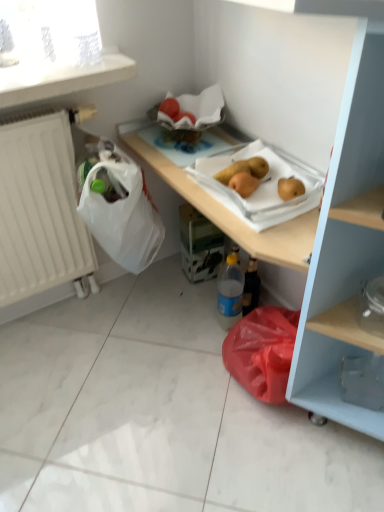
What do you see at coordinates (244, 169) in the screenshot?
I see `yellow matte pear at center` at bounding box center [244, 169].

The height and width of the screenshot is (512, 384). Describe the element at coordinates (230, 292) in the screenshot. I see `blue plastic bottle at lower center` at that location.

At what (x,y) coordinates should I click in order to perform the action: click on yellow matte pear at center. Please return your answer as a coordinate pair (x, y). This screenshot has width=384, height=512. Looking at the image, I should click on (244, 169).

What are the coordinates of `bottle on the right of transparent plastic carton at center` in the screenshot? It's located at (x=230, y=292).

Is transparent plastic carton at center spatially inside blue plastic bottle at lower center, or outside of it?

transparent plastic carton at center is not enclosed by blue plastic bottle at lower center.

From the picture: Considering the sizes of objects transparent plastic carton at center and blue plastic bottle at lower center in the image provided, who is taller, transparent plastic carton at center or blue plastic bottle at lower center?

blue plastic bottle at lower center.

In terms of height, does white matte radiator at left look taller or shorter compared to yellow matte pear at center?

Clearly, white matte radiator at left is taller compared to yellow matte pear at center.

Which is correct: white matte radiator at left is inside yellow matte pear at center, or outside of it?

white matte radiator at left is located beyond the bounds of yellow matte pear at center.

Locate an element on the screen. This screenshot has width=384, height=512. radiator that appears below the yellow matte pear at center (from a real-world perspective) is located at coordinates (41, 211).

From the image's perspective, who appears lower, white matte radiator at left or yellow matte pear at center?

white matte radiator at left appears lower in the image.

Identify the location of food that appears above the white matte radiator at left (from a real-world perspective). This screenshot has width=384, height=512. (244, 169).

Does point (250, 168) appear closer or farther from the camera than point (40, 226)?

Point (250, 168).

In terms of width, does yellow matte pear at center look wider or thinner when compared to white matte radiator at left?

Clearly, yellow matte pear at center has more width compared to white matte radiator at left.

From the picture: Between yellow matte pear at center and white matte radiator at left, which one appears on the left side from the viewer's perspective?

white matte radiator at left.

Locate an element on the screen. The image size is (384, 512). carton below the yellow matte pear at center (from the image's perspective) is located at coordinates (199, 244).

Who is taller, transparent plastic carton at center or yellow matte pear at center?

transparent plastic carton at center is taller.

From the image's perspective, relative to yellow matte pear at center, is transparent plastic carton at center above or below?

Clearly, from the image's perspective, transparent plastic carton at center is below yellow matte pear at center.

Can you confirm if transparent plastic carton at center is thinner than yellow matte pear at center?

No, transparent plastic carton at center is not thinner than yellow matte pear at center.

Could you tell me if white matte radiator at left is facing transparent plastic carton at center?

No, white matte radiator at left is not aimed at transparent plastic carton at center.

From a real-world perspective, is white matte radiator at left positioned under transparent plastic carton at center based on gravity?

Incorrect, from a real-world perspective, white matte radiator at left is higher than transparent plastic carton at center.

From the image's perspective, is white matte radiator at left below transparent plastic carton at center?

Actually, white matte radiator at left appears above transparent plastic carton at center in the image.

Between point (58, 123) and point (209, 253), which one is positioned behind?

The point (209, 253) is farther from the camera.

Is blue plastic bottle at lower center positioned before white matte radiator at left?

No, it is not.

Can white matte radiator at left be found inside blue plastic bottle at lower center?

Actually, white matte radiator at left is outside blue plastic bottle at lower center.

Looking at the image, does blue plastic bottle at lower center seem bigger or smaller compared to white matte radiator at left?

Clearly, blue plastic bottle at lower center is smaller in size than white matte radiator at left.

Is transparent plastic carton at center positioned beyond the bounds of white matte radiator at left?

Absolutely, transparent plastic carton at center is external to white matte radiator at left.

Which of these two, transparent plastic carton at center or white matte radiator at left, is bigger?

white matte radiator at left.

From a real-world perspective, is transparent plastic carton at center located beneath white matte radiator at left?

Indeed, from a real-world perspective, transparent plastic carton at center is positioned beneath white matte radiator at left.

Considering the sizes of objects transparent plastic carton at center and white matte radiator at left in the image provided, who is wider, transparent plastic carton at center or white matte radiator at left?

Wider between the two is transparent plastic carton at center.

Where is `carton behind the blue plastic bottle at lower center`? carton behind the blue plastic bottle at lower center is located at coordinates (199, 244).

Locate an element on the screen. food above the white matte radiator at left (from the image's perspective) is located at coordinates (244, 169).

Estimate the real-world distances between objects in this image. Which object is further from white matte radiator at left, transparent plastic carton at center or yellow matte pear at center?

yellow matte pear at center.

Considering their positions, is blue plastic bottle at lower center positioned further to transparent plastic carton at center than white matte radiator at left?

Based on the image, white matte radiator at left appears to be further to transparent plastic carton at center.

When comparing their distances from yellow matte pear at center, does transparent plastic carton at center or blue plastic bottle at lower center seem further?

blue plastic bottle at lower center is positioned further to the anchor yellow matte pear at center.

Considering their positions, is blue plastic bottle at lower center positioned closer to yellow matte pear at center than transparent plastic carton at center?

transparent plastic carton at center lies closer to yellow matte pear at center than the other object.

From the image, which object appears to be nearer to transparent plastic carton at center, yellow matte pear at center or white matte radiator at left?

The object closer to transparent plastic carton at center is white matte radiator at left.

Looking at this image, from the image, which object appears to be farther from yellow matte pear at center, white matte radiator at left or blue plastic bottle at lower center?

white matte radiator at left is positioned further to the anchor yellow matte pear at center.

Which object lies nearer to the anchor point white matte radiator at left, blue plastic bottle at lower center or yellow matte pear at center?

yellow matte pear at center is closer to white matte radiator at left.

Considering their positions, is white matte radiator at left positioned closer to transparent plastic carton at center than yellow matte pear at center?

Among the two, white matte radiator at left is located nearer to transparent plastic carton at center.

I want to click on carton between white matte radiator at left and blue plastic bottle at lower center in the horizontal direction, so click(199, 244).

The height and width of the screenshot is (512, 384). I want to click on food between white matte radiator at left and blue plastic bottle at lower center from left to right, so click(244, 169).

Find the location of `bottle between yellow matte pear at center and transparent plastic carton at center in the front-back direction`. bottle between yellow matte pear at center and transparent plastic carton at center in the front-back direction is located at coordinates (230, 292).

I want to click on carton located between white matte radiator at left and yellow matte pear at center in the left-right direction, so click(x=199, y=244).